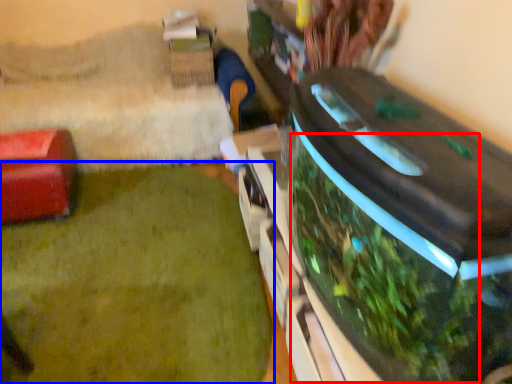
Question: Which point is closer to the camera, vegetation (highlighted by a red box) or plant (highlighted by a blue box)?

Choices:
 (A) vegetation
 (B) plant

Answer: (A)